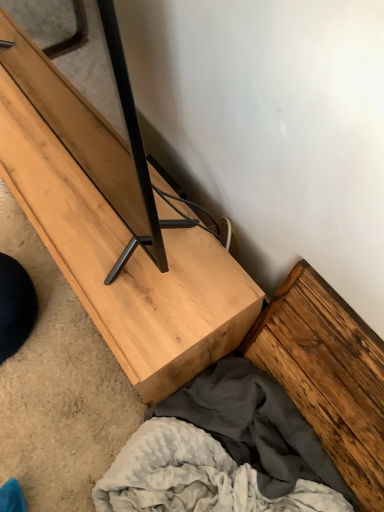
Question: Does wooden plank at lower right, arranged as the 1th plank when ordered from the bottom, have a larger size compared to black matte wood plank at center, placed as the second plank when sorted from bottom to top?

Choices:
 (A) yes
 (B) no

Answer: (B)

Question: Is wooden plank at lower right, acting as the second plank starting from the left, positioned far away from black matte wood plank at center, the 1th plank positioned from the top?

Choices:
 (A) yes
 (B) no

Answer: (B)

Question: Is wooden plank at lower right, acting as the 2th plank starting from the top, smaller than black matte wood plank at center, arranged as the first plank when viewed from the left?

Choices:
 (A) no
 (B) yes

Answer: (B)

Question: Is wooden plank at lower right, arranged as the 1th plank when ordered from the bottom, positioned in front of black matte wood plank at center, the 2th plank positioned from the right?

Choices:
 (A) yes
 (B) no

Answer: (B)

Question: Can you confirm if wooden plank at lower right, arranged as the 1th plank when ordered from the bottom, is shorter than black matte wood plank at center, placed as the second plank when sorted from bottom to top?

Choices:
 (A) no
 (B) yes

Answer: (B)

Question: In the image, is black matte wood plank at center, placed as the second plank when sorted from bottom to top, positioned in front of or behind natural wood tv stand at center?

Choices:
 (A) front
 (B) behind

Answer: (A)

Question: Is black matte wood plank at center, the 2th plank positioned from the right, to the left or to the right of natural wood tv stand at center in the image?

Choices:
 (A) left
 (B) right

Answer: (A)

Question: From the image's perspective, is black matte wood plank at center, arranged as the first plank when viewed from the left, located above or below natural wood tv stand at center?

Choices:
 (A) below
 (B) above

Answer: (B)

Question: From a real-world perspective, is black matte wood plank at center, the 1th plank positioned from the top, above or below natural wood tv stand at center?

Choices:
 (A) above
 (B) below

Answer: (A)

Question: Is black matte wood plank at center, the 2th plank positioned from the right, spatially inside wooden plank at lower right, acting as the second plank starting from the left, or outside of it?

Choices:
 (A) inside
 (B) outside

Answer: (B)

Question: Based on their sizes in the image, would you say black matte wood plank at center, arranged as the first plank when viewed from the left, is bigger or smaller than wooden plank at lower right, acting as the second plank starting from the left?

Choices:
 (A) small
 (B) big

Answer: (B)

Question: From a real-world perspective, relative to wooden plank at lower right, arranged as the 1th plank when ordered from the bottom, is black matte wood plank at center, arranged as the first plank when viewed from the left, vertically above or below?

Choices:
 (A) above
 (B) below

Answer: (A)

Question: From their relative heights in the image, would you say black matte wood plank at center, arranged as the first plank when viewed from the left, is taller or shorter than wooden plank at lower right, arranged as the 1th plank when ordered from the bottom?

Choices:
 (A) tall
 (B) short

Answer: (A)

Question: Is wooden plank at lower right, acting as the 2th plank starting from the top, taller or shorter than natural wood tv stand at center?

Choices:
 (A) tall
 (B) short

Answer: (A)

Question: From a real-world perspective, is wooden plank at lower right, acting as the second plank starting from the left, above or below natural wood tv stand at center?

Choices:
 (A) below
 (B) above

Answer: (B)